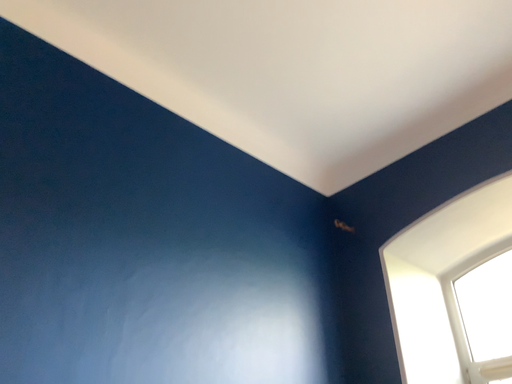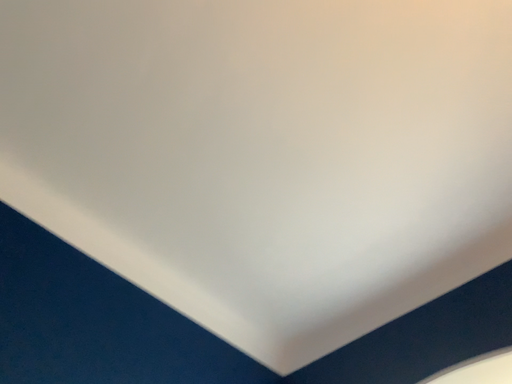
Question: How did the camera likely rotate when shooting the video?

Choices:
 (A) rotated upward
 (B) rotated downward

Answer: (A)